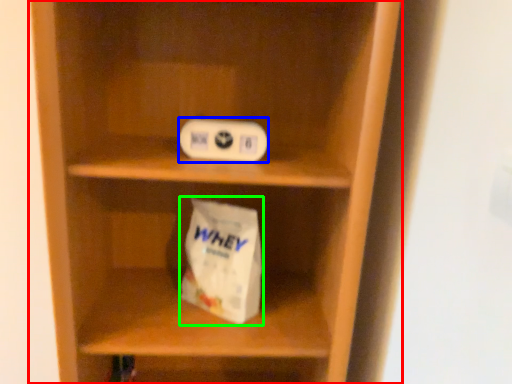
Question: Based on their relative distances, which object is farther from shelf (highlighted by a red box)? Choose from ipod (highlighted by a blue box) and paper bag (highlighted by a green box).

Choices:
 (A) ipod
 (B) paper bag

Answer: (A)